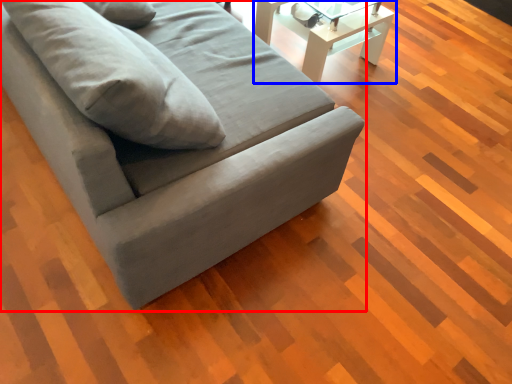
Question: Which of the following is the closest to the observer, studio couch (highlighted by a red box) or table (highlighted by a blue box)?

Choices:
 (A) studio couch
 (B) table

Answer: (A)